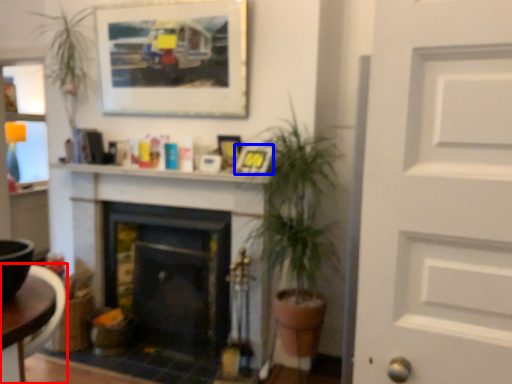
Question: Which object appears farthest to the camera in this image, table (highlighted by a red box) or picture frame (highlighted by a blue box)?

Choices:
 (A) table
 (B) picture frame

Answer: (B)